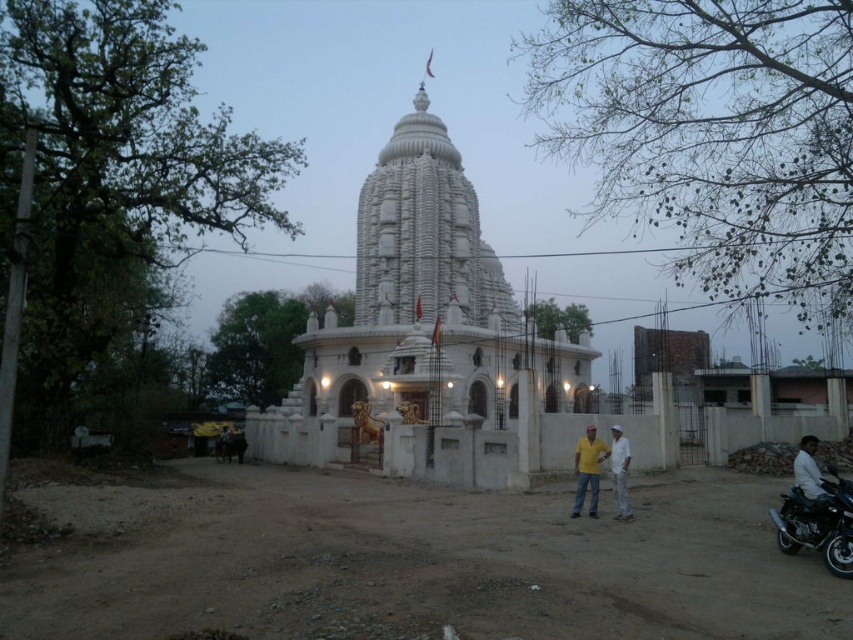
Question: Which of these objects is positioned farthest from the white stone hindu temple at center?

Choices:
 (A) white cotton pants at lower center
 (B) brown dirt field at center
 (C) shiny black motorcycle at lower right

Answer: (C)

Question: Among these objects, which one is nearest to the camera?

Choices:
 (A) white cotton pants at lower center
 (B) white stone hindu temple at center
 (C) shiny black motorcycle at lower right
 (D) brown dirt field at center

Answer: (D)

Question: Can you confirm if yellow cotton shirt at center is positioned to the left of white cotton pants at lower center?

Choices:
 (A) no
 (B) yes

Answer: (B)

Question: Is white stone hindu temple at center wider than white cotton pants at lower center?

Choices:
 (A) yes
 (B) no

Answer: (A)

Question: Estimate the real-world distances between objects in this image. Which object is farther from the white stone hindu temple at center?

Choices:
 (A) brown dirt field at center
 (B) shiny black motorcycle at lower right

Answer: (B)

Question: Is shiny black motorcycle at lower right thinner than yellow cotton shirt at center?

Choices:
 (A) yes
 (B) no

Answer: (B)